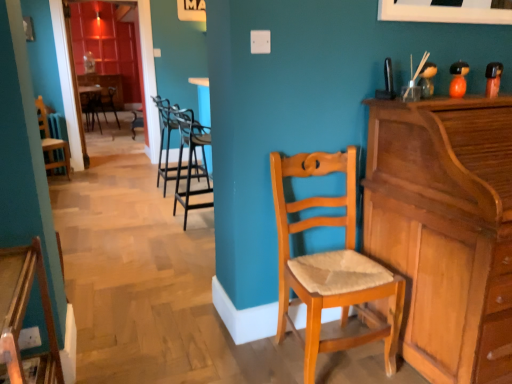
In order to click on free region under black metal barstools at center, which appears as the fourth chair when viewed from the back (from a real-world perspective) in this screenshot , I will do `click(197, 220)`.